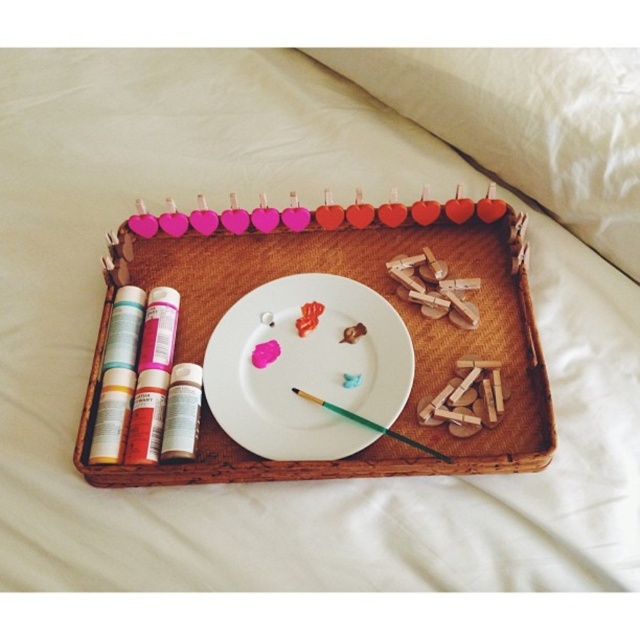
Is white matte paper plate at center to the right of green wood paint brush at center from the viewer's perspective?

In fact, white matte paper plate at center is to the left of green wood paint brush at center.

Between white matte paper plate at center and green wood paint brush at center, which one appears on the right side from the viewer's perspective?

green wood paint brush at center

Measure the distance between point (369, 332) and camera.

They are 3.80 feet apart.

This screenshot has width=640, height=640. I want to click on white matte paper plate at center, so click(x=307, y=369).

Between point (515, 266) and point (301, 390), which one is positioned in front?

Point (301, 390) is more forward.

Consider the image. Does woven wood tray at center come behind green wood paint brush at center?

No, woven wood tray at center is closer to the viewer.

What do you see at coordinates (380, 292) in the screenshot? Image resolution: width=640 pixels, height=640 pixels. I see `woven wood tray at center` at bounding box center [380, 292].

You are a GUI agent. You are given a task and a screenshot of the screen. Output one action in this format:
    pyautogui.click(x=<x>, y=<y>)
    Task: Click on the woven wood tray at center
    The width and height of the screenshot is (640, 640).
    Given the screenshot: What is the action you would take?
    pyautogui.click(x=380, y=292)

Is woven wood tray at center thinner than white matte paper plate at center?

No, woven wood tray at center is not thinner than white matte paper plate at center.

Does woven wood tray at center have a larger size compared to white matte paper plate at center?

Correct, woven wood tray at center is larger in size than white matte paper plate at center.

Image resolution: width=640 pixels, height=640 pixels. What do you see at coordinates (380, 292) in the screenshot? I see `woven wood tray at center` at bounding box center [380, 292].

You are a GUI agent. You are given a task and a screenshot of the screen. Output one action in this format:
    pyautogui.click(x=<x>, y=<y>)
    Task: Click on the woven wood tray at center
    
    Given the screenshot: What is the action you would take?
    pyautogui.click(x=380, y=292)